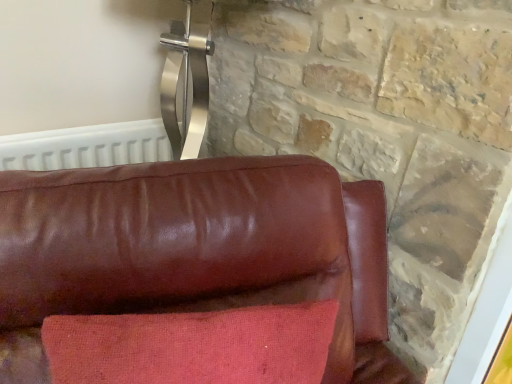
The image size is (512, 384). Describe the element at coordinates (195, 251) in the screenshot. I see `leather couch at center` at that location.

Image resolution: width=512 pixels, height=384 pixels. What are the coordinates of `leather couch at center` in the screenshot? It's located at (195, 251).

Identify the location of leather couch at center. This screenshot has width=512, height=384. (195, 251).